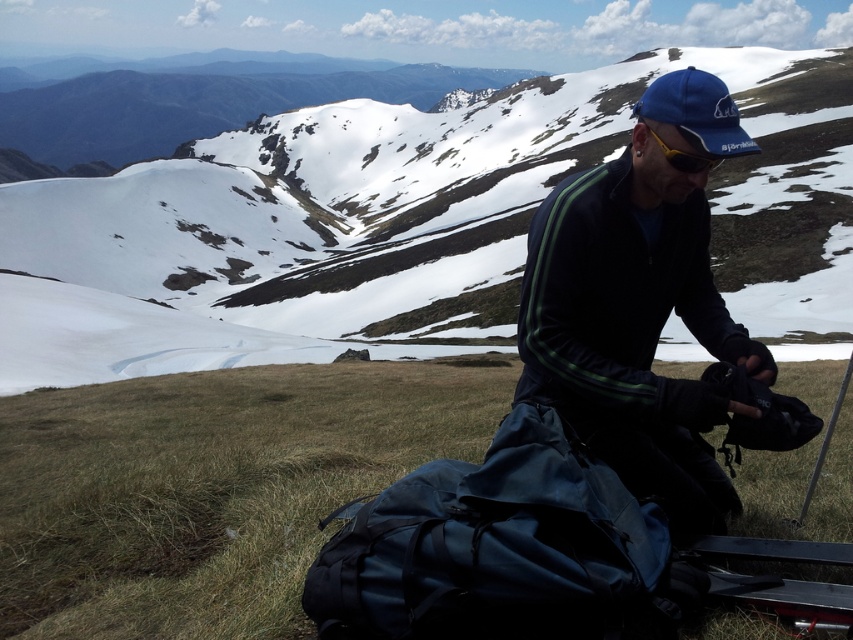
What do you see at coordinates (639, 305) in the screenshot?
I see `dark blue fleece jacket at center` at bounding box center [639, 305].

Is dark blue fleece jacket at center above yellow matte/glossy goggles at center?

Incorrect, dark blue fleece jacket at center is not positioned above yellow matte/glossy goggles at center.

Locate an element on the screen. Image resolution: width=853 pixels, height=640 pixels. dark blue fleece jacket at center is located at coordinates (639, 305).

Where is `dark blue fleece jacket at center`? dark blue fleece jacket at center is located at coordinates (639, 305).

Does point (543, 104) lie in front of point (712, 164)?

No, (543, 104) is behind (712, 164).

Locate an element on the screen. Image resolution: width=853 pixels, height=640 pixels. snowy mountain at upper center is located at coordinates (407, 227).

Does point (509, 310) lie in front of point (660, 445)?

No, (509, 310) is behind (660, 445).

Which is below, snowy mountain at upper center or dark blue fleece jacket at center?

dark blue fleece jacket at center is below.

Does point (36, 253) come farther from viewer compared to point (624, 179)?

Yes, it is.

You are a GUI agent. You are given a task and a screenshot of the screen. Output one action in this format:
    pyautogui.click(x=<x>, y=<y>)
    Task: Click on the snowy mountain at upper center
    This screenshot has width=853, height=640.
    Given the screenshot: What is the action you would take?
    pyautogui.click(x=407, y=227)